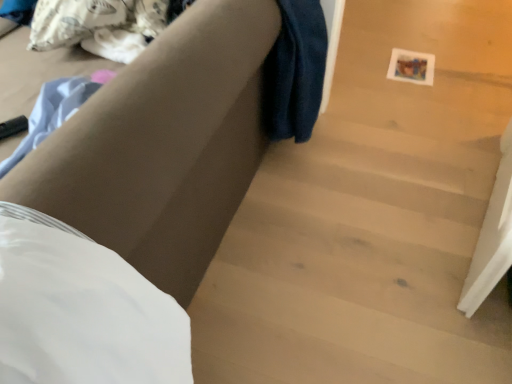
Question: Considering the relative sizes of white matte sheet at lower left and wooden stairs at center in the image provided, is white matte sheet at lower left shorter than wooden stairs at center?

Choices:
 (A) no
 (B) yes

Answer: (A)

Question: Is white matte sheet at lower left aimed at wooden stairs at center?

Choices:
 (A) yes
 (B) no

Answer: (B)

Question: Considering the relative sizes of white matte sheet at lower left and wooden stairs at center in the image provided, is white matte sheet at lower left thinner than wooden stairs at center?

Choices:
 (A) no
 (B) yes

Answer: (B)

Question: Is white matte sheet at lower left looking in the opposite direction of wooden stairs at center?

Choices:
 (A) no
 (B) yes

Answer: (B)

Question: Is the position of white matte sheet at lower left more distant than that of wooden stairs at center?

Choices:
 (A) no
 (B) yes

Answer: (A)

Question: Considering their positions, is white matte sheet at lower left located in front of or behind wooden stairs at center?

Choices:
 (A) front
 (B) behind

Answer: (A)

Question: In terms of height, does white matte sheet at lower left look taller or shorter compared to wooden stairs at center?

Choices:
 (A) tall
 (B) short

Answer: (A)

Question: Is white matte sheet at lower left situated inside wooden stairs at center or outside?

Choices:
 (A) inside
 (B) outside

Answer: (B)

Question: Looking at their shapes, would you say white matte sheet at lower left is wider or thinner than wooden stairs at center?

Choices:
 (A) wide
 (B) thin

Answer: (B)

Question: From a real-world perspective, relative to wooden stairs at center, is matte brown couch at center vertically above or below?

Choices:
 (A) below
 (B) above

Answer: (B)

Question: From their relative heights in the image, would you say matte brown couch at center is taller or shorter than wooden stairs at center?

Choices:
 (A) tall
 (B) short

Answer: (A)

Question: In terms of size, does matte brown couch at center appear bigger or smaller than wooden stairs at center?

Choices:
 (A) small
 (B) big

Answer: (B)

Question: In the image, is matte brown couch at center positioned in front of or behind wooden stairs at center?

Choices:
 (A) behind
 (B) front

Answer: (B)

Question: Is wooden stairs at center in front of or behind matte brown couch at center in the image?

Choices:
 (A) front
 (B) behind

Answer: (B)

Question: In terms of width, does wooden stairs at center look wider or thinner when compared to matte brown couch at center?

Choices:
 (A) thin
 (B) wide

Answer: (B)